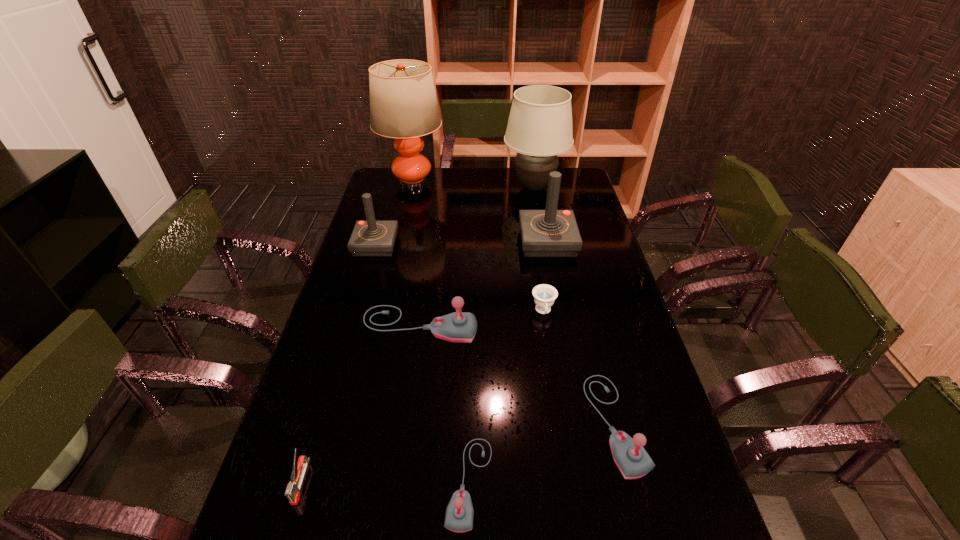
Identify the location of the second smallest gray joystick. (629, 455).

Identify the location of gray stapler. (299, 468).

Image resolution: width=960 pixels, height=540 pixels. I want to click on the shortest joystick, so click(x=459, y=515).

Where is `blue teacup`? blue teacup is located at coordinates (544, 295).

Identify the location of the shortest object. The height and width of the screenshot is (540, 960). (544, 295).

Locate an element on the screen. free location located 0.360m on the front of the tallest object is located at coordinates (396, 253).

At what (x,y) coordinates should I click in order to perform the action: click on vacant space located 0.320m on the front of the lampshade. Please return your answer as a coordinate pair (x, y). This screenshot has width=960, height=540. Looking at the image, I should click on click(546, 253).

Where is `free space located on the rectangular base of the seventh shortest object`? This screenshot has width=960, height=540. free space located on the rectangular base of the seventh shortest object is located at coordinates (506, 242).

At what (x,y) coordinates should I click in order to perform the action: click on free space located on the rectangular base of the seventh shortest object. Please return your answer as a coordinate pair (x, y). The image size is (960, 540). Looking at the image, I should click on (479, 242).

Identify the location of free location located on the rectangular base of the seventh shortest object. (x=435, y=242).